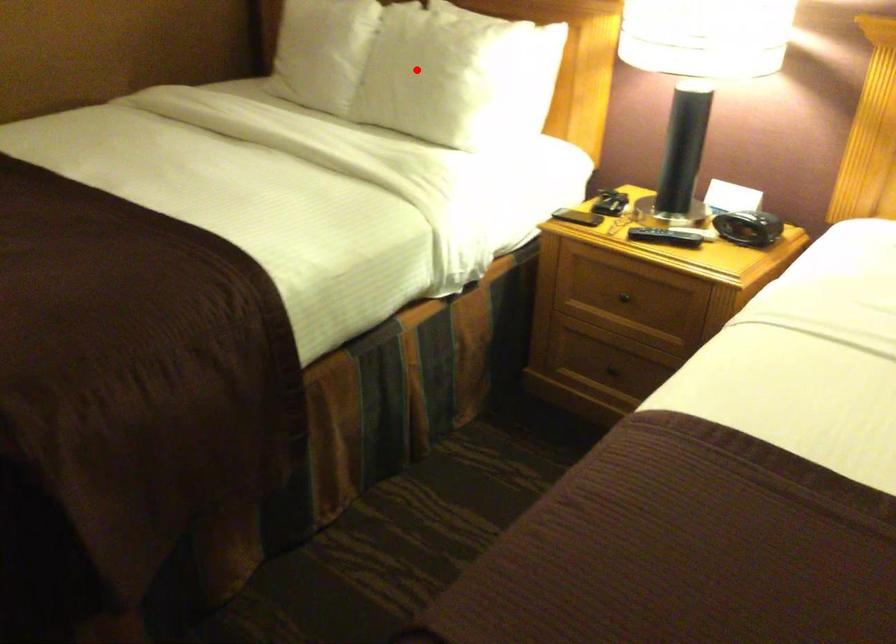
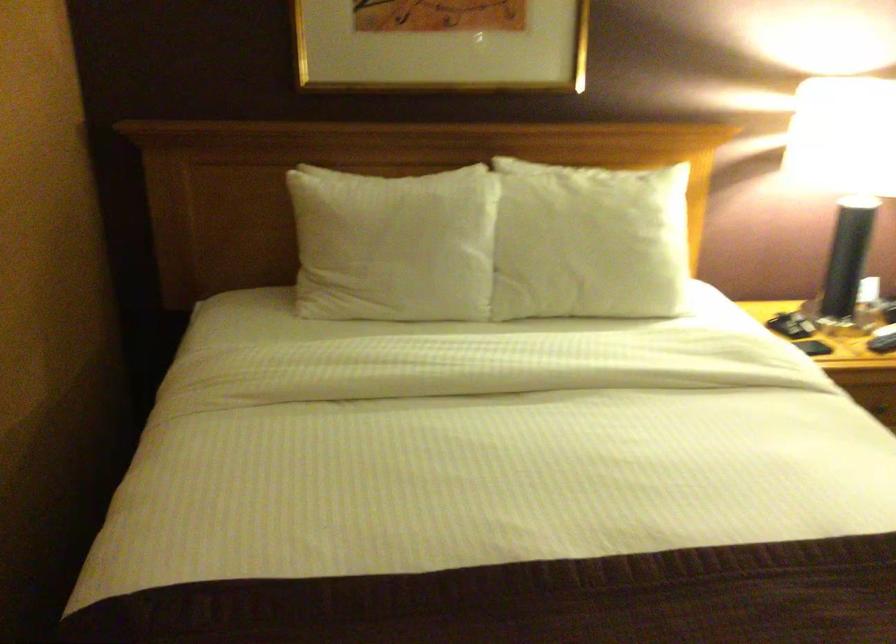
Question: I am providing you with two images of the same scene from different viewpoints. A red point is shown in image1. For the corresponding object point in image2, is it positioned nearer or farther from the camera?

Choices:
 (A) Nearer
 (B) Farther

Answer: (A)